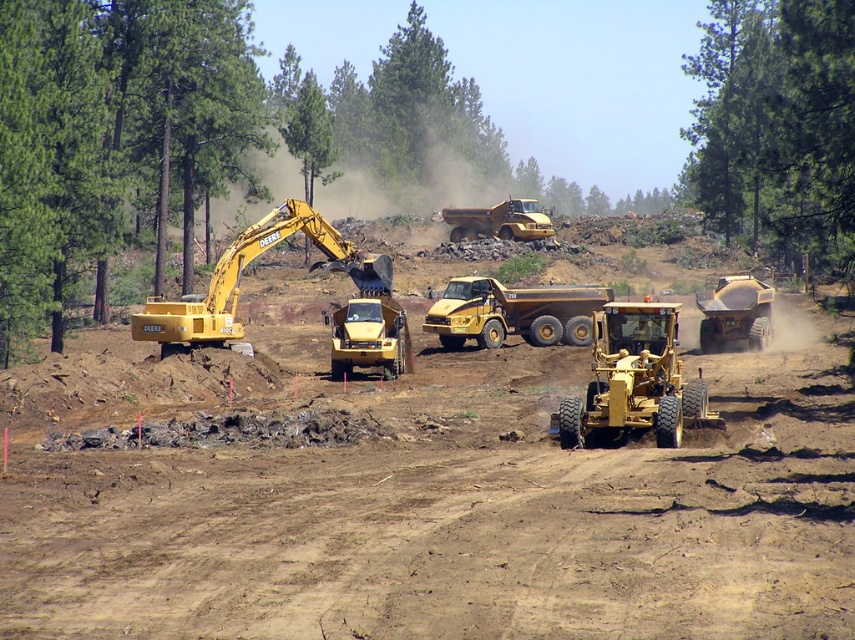
Does green leafy tree at upper center lie behind yellow metallic dump truck at center?

No, it is in front of yellow metallic dump truck at center.

Between point (771, 28) and point (463, 218), which one is positioned behind?

The point (771, 28) is behind.

The image size is (855, 640). What are the coordinates of `green leafy tree at upper center` in the screenshot? It's located at (776, 122).

Can you confirm if green leafy tree at upper center is thinner than matte yellow tractor at right?

Incorrect, green leafy tree at upper center's width is not less than matte yellow tractor at right's.

Does green leafy tree at upper center appear on the right side of matte yellow tractor at right?

Correct, you'll find green leafy tree at upper center to the right of matte yellow tractor at right.

Does point (838, 154) lie in front of point (741, 310)?

Yes, it is.

Identify the location of green leafy tree at upper center. The width and height of the screenshot is (855, 640). (776, 122).

Does point (557, 305) lie in front of point (746, 280)?

No.

Between yellow matte dump truck at center and matte yellow tractor at right, which one appears on the right side from the viewer's perspective?

matte yellow tractor at right is more to the right.

Which is behind, point (532, 324) or point (718, 307)?

Point (532, 324)

Image resolution: width=855 pixels, height=640 pixels. What are the coordinates of `yellow matte dump truck at center` in the screenshot? It's located at (513, 312).